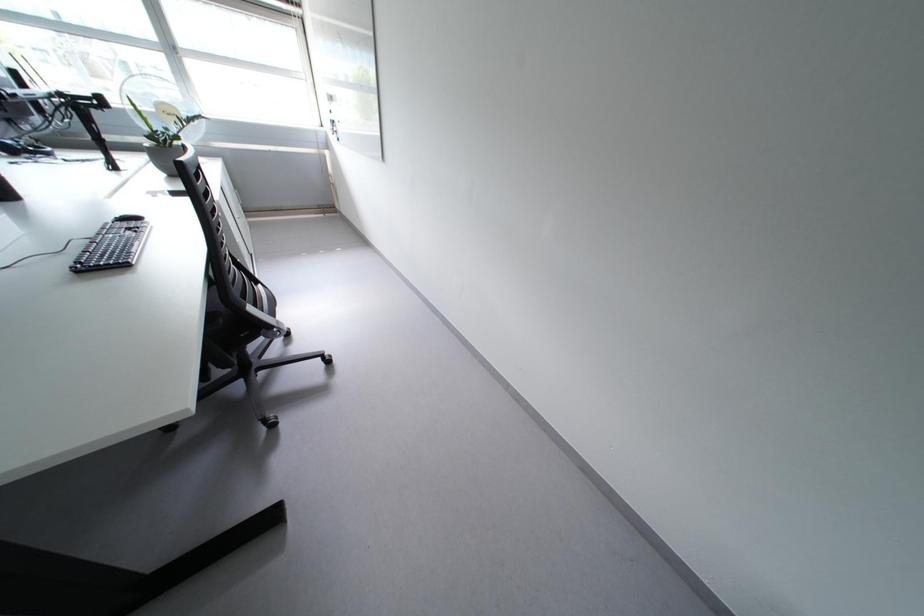
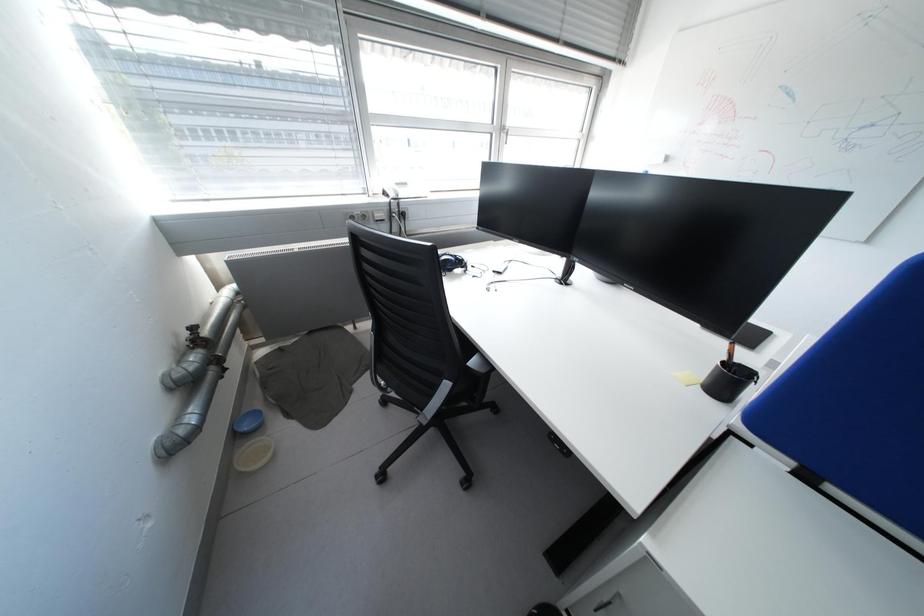
Question: What movement of the cameraman would produce the second image?

Choices:
 (A) Left
 (B) Right
 (C) Forward
 (D) Backward

Answer: (A)